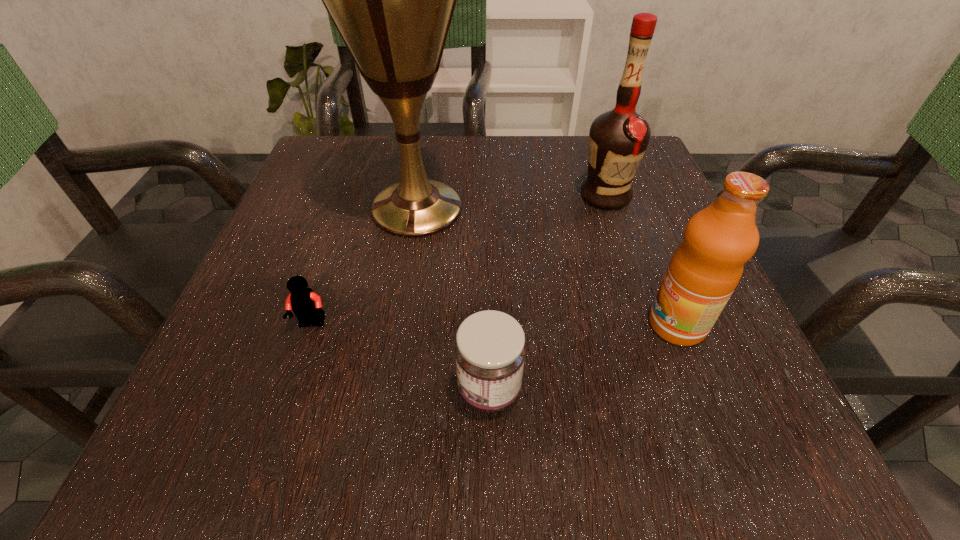
Find the location of a particular element. the tallest object is located at coordinates (392, 0).

Identify the location of the fourth shortest object. (618, 139).

You are a GUI agent. You are given a task and a screenshot of the screen. Output one action in this format:
    pyautogui.click(x=<x>, y=<y>)
    Task: Click on the third tallest object
    This screenshot has height=540, width=960.
    Given the screenshot: What is the action you would take?
    pyautogui.click(x=705, y=269)

Identify the location of the nearest object. This screenshot has height=540, width=960. (490, 350).

Where is `the fourth tallest object`? The height and width of the screenshot is (540, 960). the fourth tallest object is located at coordinates (490, 350).

Where is `Lego`? The image size is (960, 540). Lego is located at coordinates (306, 304).

This screenshot has height=540, width=960. I want to click on vacant region located 0.200m on the front of the trophy cup, so click(x=396, y=340).

Where is `vacant region located 0.380m on the front and back of the fourth shortest object`? vacant region located 0.380m on the front and back of the fourth shortest object is located at coordinates (669, 392).

Where is `vacant space located 0.250m on the label side of the third tallest object`? vacant space located 0.250m on the label side of the third tallest object is located at coordinates (479, 325).

Image resolution: width=960 pixels, height=540 pixels. In order to click on vacant space situated on the label side of the third tallest object in this screenshot , I will do `click(378, 325)`.